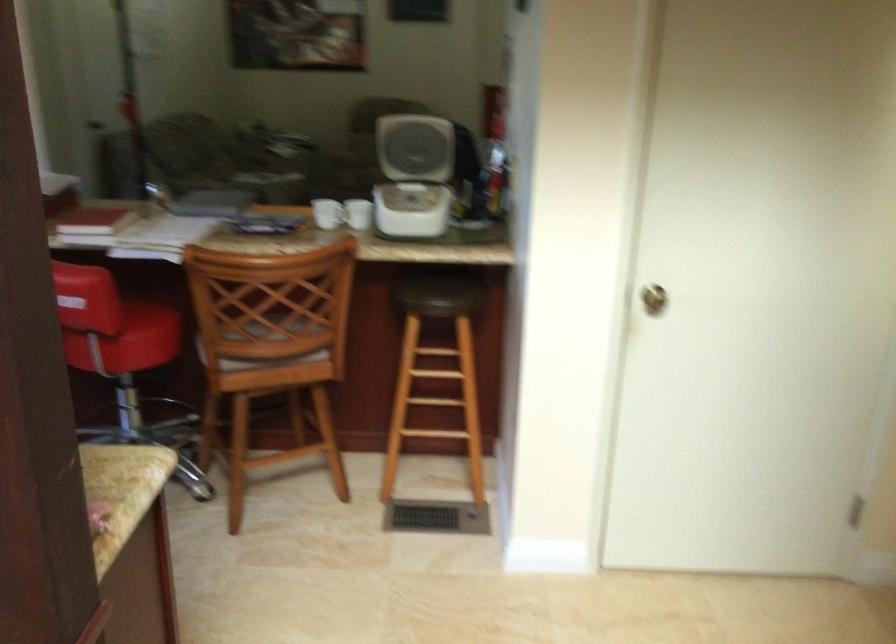
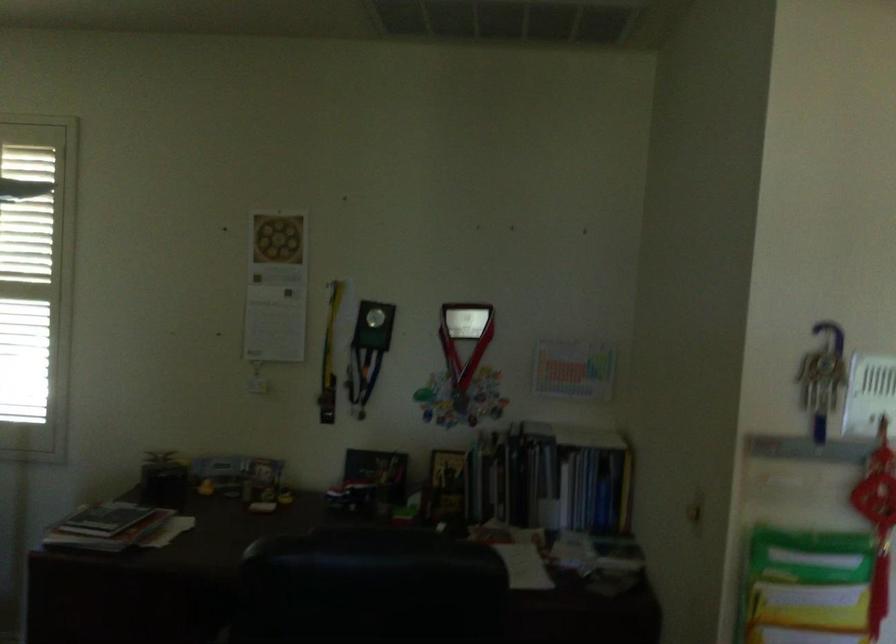
Find the pixel in the second image that matches pixel 495 131 in the first image.

(877, 522)